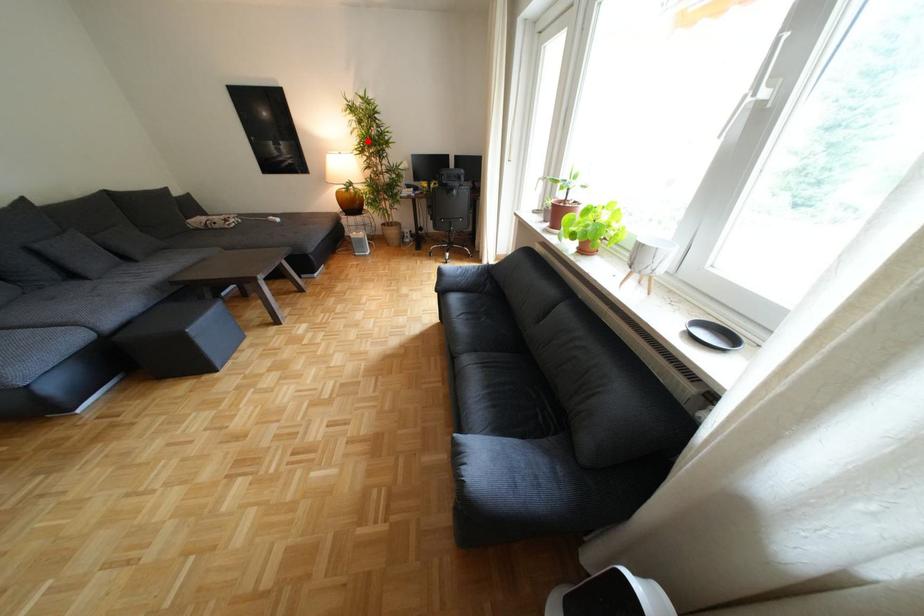
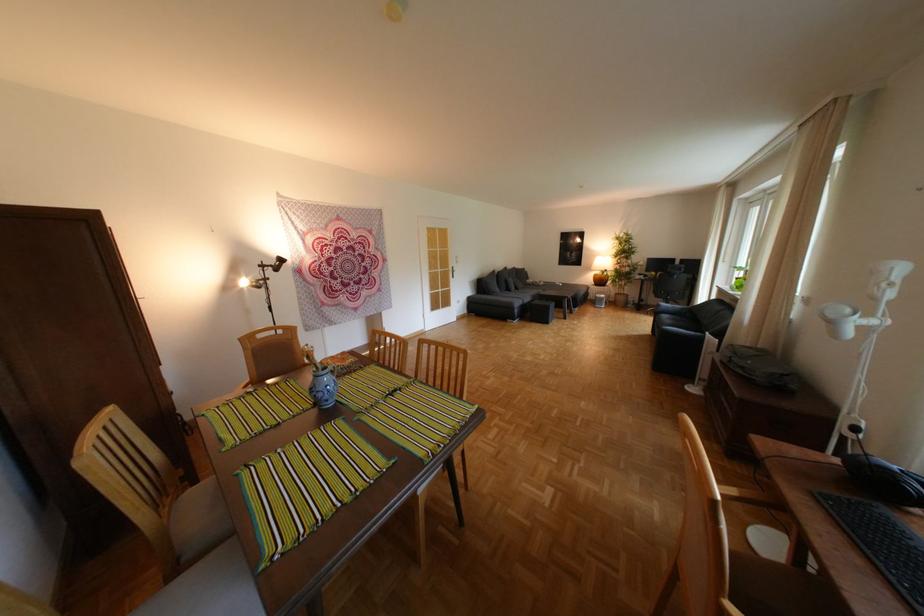
Question: I am providing you with two images of the same scene from different viewpoints. Given a red point in image1, look at the same physical point in image2. Is it:

Choices:
 (A) Closer to the viewpoint
 (B) Farther from the viewpoint

Answer: (B)